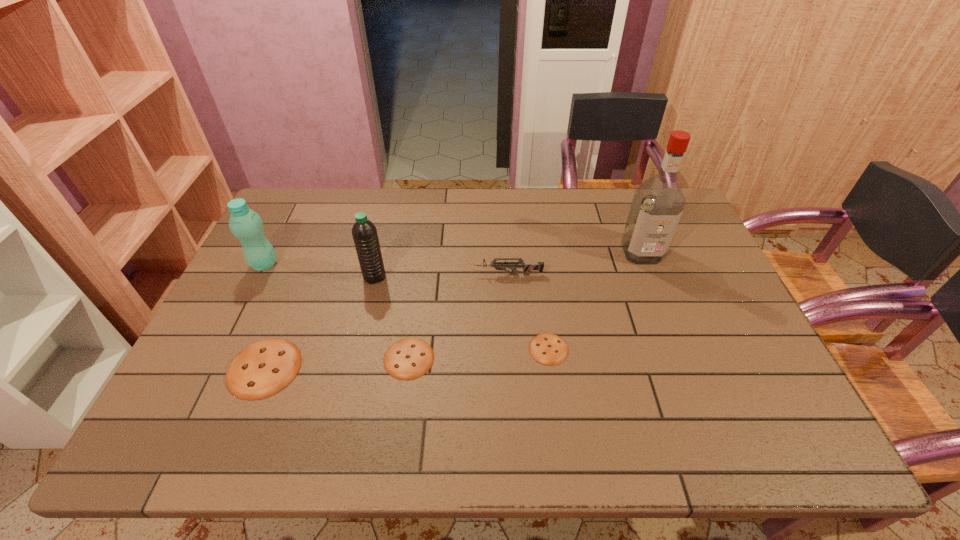
At what (x,y) coordinates should I click in order to perform the action: click on the third shortest object. Please return your answer as a coordinate pair (x, y). This screenshot has height=540, width=960. Looking at the image, I should click on (264, 368).

Find the location of a particular element. the leftmost cookie is located at coordinates (264, 368).

Image resolution: width=960 pixels, height=540 pixels. What are the coordinates of `the second cookie from right to left` in the screenshot? It's located at (410, 358).

The image size is (960, 540). In order to click on the second shortest cookie in this screenshot , I will do `click(410, 358)`.

Identify the location of the shortest object. This screenshot has height=540, width=960. (548, 349).

Locate an element on the screen. This screenshot has height=540, width=960. the rightmost cookie is located at coordinates (548, 349).

I want to click on gun, so click(527, 266).

At what (x,y) coordinates should I click in order to perform the action: click on the third object from left to right. Please return your answer as a coordinate pair (x, y). Image resolution: width=960 pixels, height=540 pixels. Looking at the image, I should click on (364, 232).

Find the location of a particular element. The image size is (960, 540). the tallest object is located at coordinates (658, 203).

I want to click on liquor, so click(x=658, y=203).